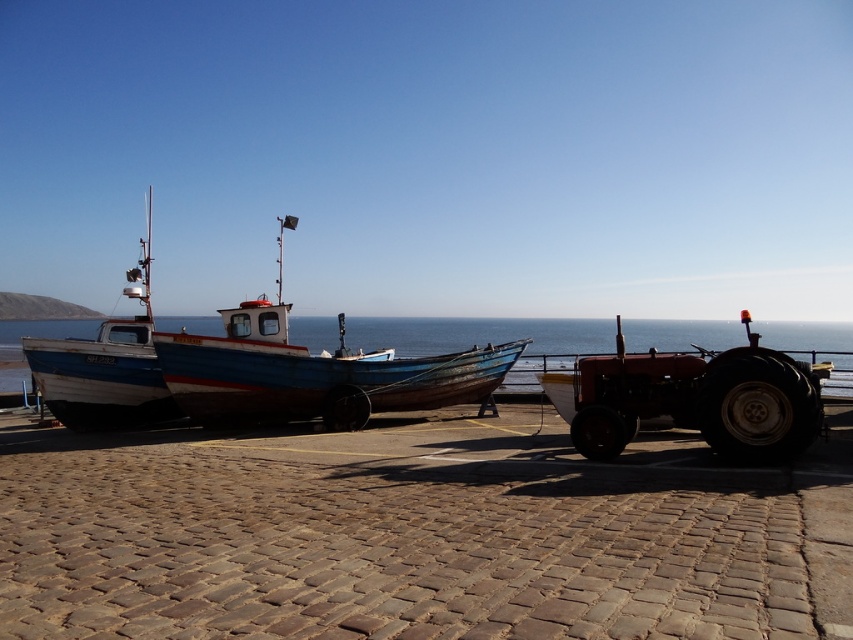
You are a photographer trying to capture both the matte red tractor at right and the white wooden boat at left in a single frame. Based on their positions, which object should you focus on first to ensure both are in the shot?

The matte red tractor at right is positioned on the right side of white wooden boat at left, so you should focus on the white wooden boat at left first to ensure both are in the shot.